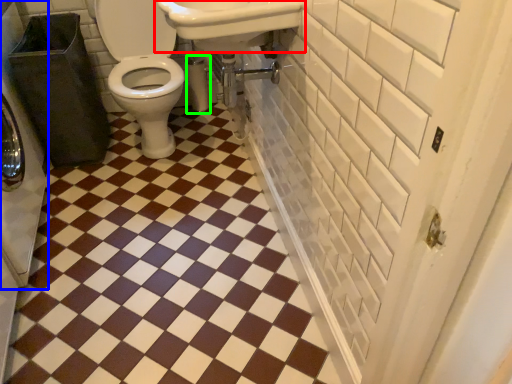
Question: Based on their relative distances, which object is nearer to sink (highlighted by a red box)? Choose from washer (highlighted by a blue box) and toilet paper (highlighted by a green box).

Choices:
 (A) washer
 (B) toilet paper

Answer: (B)